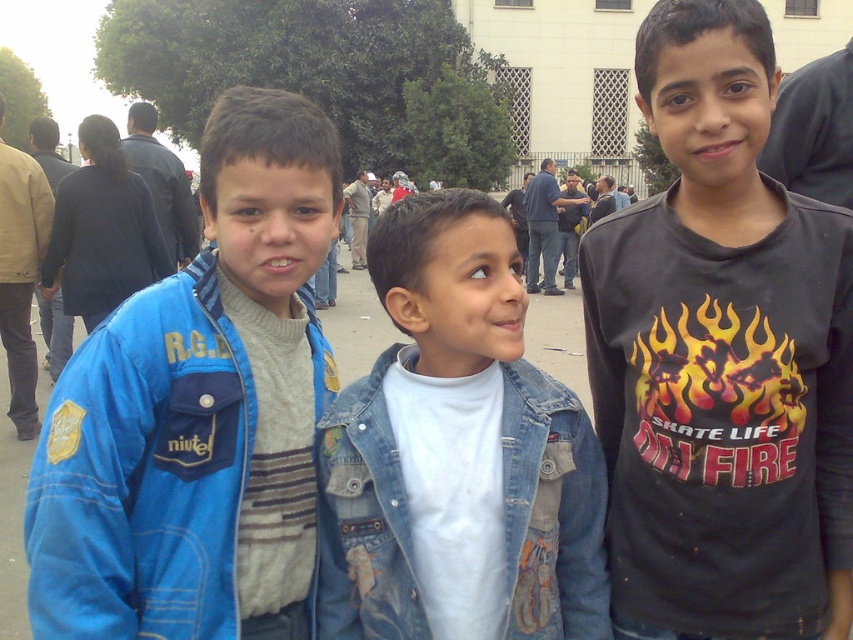
Question: Is black matte shirt at center smaller than denim jacket at center?

Choices:
 (A) no
 (B) yes

Answer: (A)

Question: Can you confirm if black matte shirt at center is positioned to the left of denim jacket at center?

Choices:
 (A) yes
 (B) no

Answer: (B)

Question: Among these objects, which one is nearest to the camera?

Choices:
 (A) black matte shirt at center
 (B) dark blue jacket at upper left
 (C) denim jacket at center

Answer: (C)

Question: Can you confirm if denim jacket at center is smaller than dark blue jacket at upper left?

Choices:
 (A) no
 (B) yes

Answer: (B)

Question: Which is nearer to the dark blue jacket at upper left?

Choices:
 (A) black matte shirt at center
 (B) brushed denim jacket at left

Answer: (B)

Question: Among these objects, which one is nearest to the camera?

Choices:
 (A) black matte shirt at center
 (B) brushed denim jacket at left

Answer: (B)